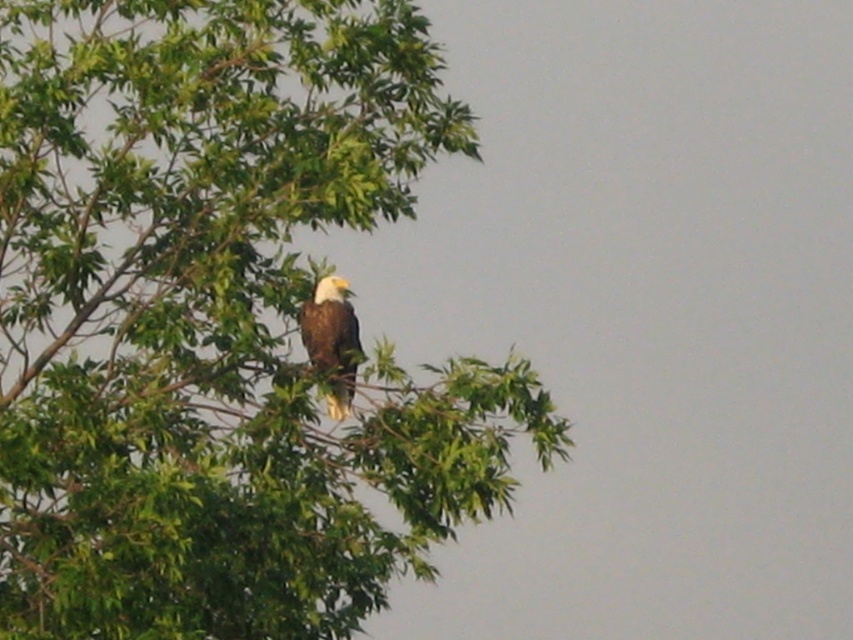
Question: Does green leafy tree at upper left have a larger size compared to white feathered eagle at upper center?

Choices:
 (A) no
 (B) yes

Answer: (B)

Question: Is green leafy tree at upper left further to the viewer compared to white feathered eagle at upper center?

Choices:
 (A) no
 (B) yes

Answer: (A)

Question: Which of the following is the closest to the observer?

Choices:
 (A) green leafy tree at upper left
 (B) white feathered eagle at upper center

Answer: (A)

Question: Does green leafy tree at upper left have a greater width compared to white feathered eagle at upper center?

Choices:
 (A) no
 (B) yes

Answer: (B)

Question: Which of the following is the farthest from the observer?

Choices:
 (A) (302, 177)
 (B) (299, 328)

Answer: (B)

Question: Which object is closer to the camera taking this photo?

Choices:
 (A) white feathered eagle at upper center
 (B) green leafy tree at upper left

Answer: (B)